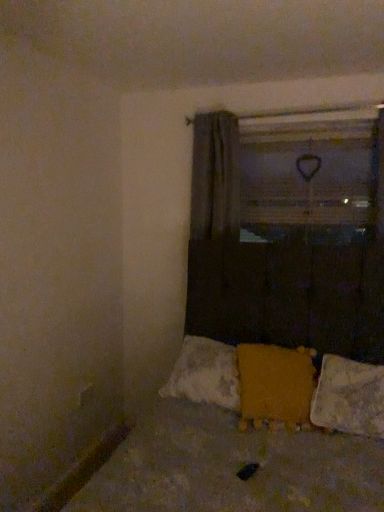
Question: Does white textured pillow at lower right, the second pillow positioned from the left, have a smaller size compared to yellow fuzzy pillow at lower center, which is the 1th pillow in left-to-right order?

Choices:
 (A) yes
 (B) no

Answer: (A)

Question: From the image's perspective, is white textured pillow at lower right, the first pillow from the right, below yellow fuzzy pillow at lower center, which is the 1th pillow in left-to-right order?

Choices:
 (A) no
 (B) yes

Answer: (B)

Question: Is the position of white textured pillow at lower right, the first pillow from the right, more distant than that of yellow fuzzy pillow at lower center, which is the 1th pillow in left-to-right order?

Choices:
 (A) no
 (B) yes

Answer: (A)

Question: From a real-world perspective, is white textured pillow at lower right, the second pillow positioned from the left, beneath yellow fuzzy pillow at lower center, the 2th pillow from the right?

Choices:
 (A) no
 (B) yes

Answer: (B)

Question: In terms of width, does white textured pillow at lower right, the first pillow from the right, look wider or thinner when compared to yellow fabric at center?

Choices:
 (A) wide
 (B) thin

Answer: (A)

Question: Is white textured pillow at lower right, the second pillow positioned from the left, bigger or smaller than yellow fabric at center?

Choices:
 (A) big
 (B) small

Answer: (B)

Question: In terms of height, does white textured pillow at lower right, the first pillow from the right, look taller or shorter compared to yellow fabric at center?

Choices:
 (A) tall
 (B) short

Answer: (A)

Question: Is point (379, 400) positioned closer to the camera than point (203, 346)?

Choices:
 (A) closer
 (B) farther

Answer: (A)

Question: In the image, is yellow fuzzy pillow at lower center, which is the 1th pillow in left-to-right order, on the left side or the right side of white textured pillow at lower right, the second pillow positioned from the left?

Choices:
 (A) right
 (B) left

Answer: (B)

Question: From a real-world perspective, is yellow fuzzy pillow at lower center, the 2th pillow from the right, above or below white textured pillow at lower right, the second pillow positioned from the left?

Choices:
 (A) above
 (B) below

Answer: (A)

Question: Do you think yellow fuzzy pillow at lower center, which is the 1th pillow in left-to-right order, is within white textured pillow at lower right, the first pillow from the right, or outside of it?

Choices:
 (A) outside
 (B) inside

Answer: (A)

Question: In the image, is yellow fuzzy pillow at lower center, which is the 1th pillow in left-to-right order, positioned in front of or behind white textured pillow at lower right, the second pillow positioned from the left?

Choices:
 (A) behind
 (B) front

Answer: (A)

Question: Considering the relative positions of yellow fabric at center and textured yellow fabric at lower center in the image provided, is yellow fabric at center to the left or to the right of textured yellow fabric at lower center?

Choices:
 (A) right
 (B) left

Answer: (A)

Question: Is point (256, 348) positioned closer to the camera than point (235, 382)?

Choices:
 (A) closer
 (B) farther

Answer: (B)